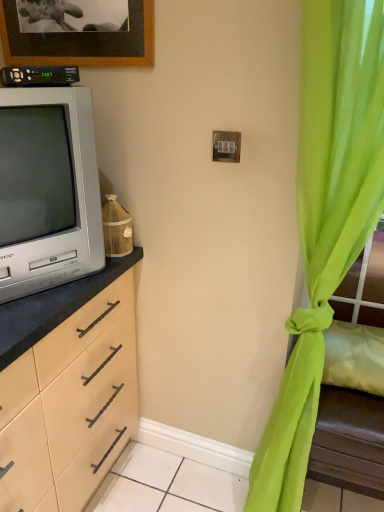
Question: From a real-world perspective, is black plastic remote control at upper left physically located above or below green sheer curtain at right?

Choices:
 (A) below
 (B) above

Answer: (B)

Question: Is black plastic remote control at upper left taller or shorter than green sheer curtain at right?

Choices:
 (A) short
 (B) tall

Answer: (A)

Question: Which is farther from the matte gray television at left?

Choices:
 (A) wooden framed picture at upper left
 (B) black plastic remote control at upper left
 (C) white plastic switch at center
 (D) green sheer curtain at right

Answer: (D)

Question: Based on their relative distances, which object is farther from the matte gray television at left?

Choices:
 (A) black plastic remote control at upper left
 (B) wooden framed picture at upper left
 (C) white plastic switch at center
 (D) green sheer curtain at right

Answer: (D)